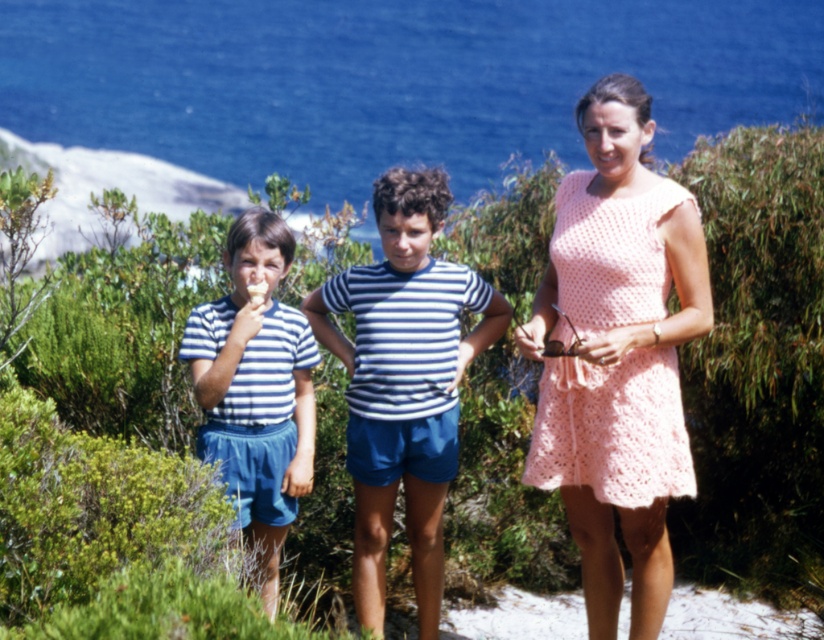
Question: Can you confirm if pink crochet dress at center is positioned below blue striped shirt at left?

Choices:
 (A) yes
 (B) no

Answer: (B)

Question: Which of these objects is positioned farthest from the blue striped shirt at center?

Choices:
 (A) pink crochet dress at center
 (B) blue striped shirt at left

Answer: (A)

Question: Estimate the real-world distances between objects in this image. Which object is farther from the blue striped shirt at left?

Choices:
 (A) pink crochet dress at center
 (B) blue striped shirt at center

Answer: (A)

Question: Does blue striped shirt at center lie behind blue striped shirt at left?

Choices:
 (A) yes
 (B) no

Answer: (A)

Question: Which of the following is the farthest from the observer?

Choices:
 (A) (620, 371)
 (B) (354, 304)

Answer: (B)

Question: Does blue striped shirt at center appear over blue striped shirt at left?

Choices:
 (A) yes
 (B) no

Answer: (A)